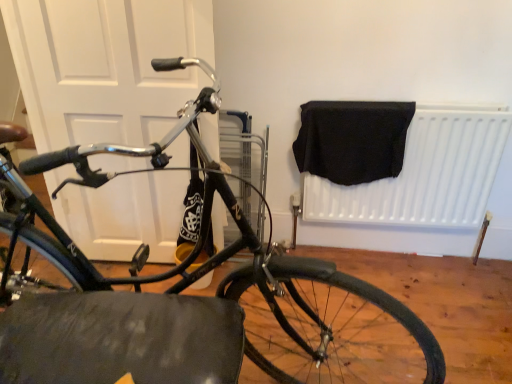
Question: Considering the positions of point (379, 160) and point (98, 137), is point (379, 160) closer or farther from the camera than point (98, 137)?

Choices:
 (A) closer
 (B) farther

Answer: (B)

Question: Considering their positions, is black fabric at upper right located in front of or behind white matte door at left?

Choices:
 (A) behind
 (B) front

Answer: (A)

Question: Estimate the real-world distances between objects in this image. Which object is closer to the black rubber tire at lower center?

Choices:
 (A) white matte door at left
 (B) white matte radiator at upper right
 (C) shiny black bicycle at center
 (D) black fabric at upper right

Answer: (C)

Question: Estimate the real-world distances between objects in this image. Which object is closer to the white matte radiator at upper right?

Choices:
 (A) black fabric at upper right
 (B) white matte door at left
 (C) shiny black bicycle at center
 (D) black rubber tire at lower center

Answer: (A)